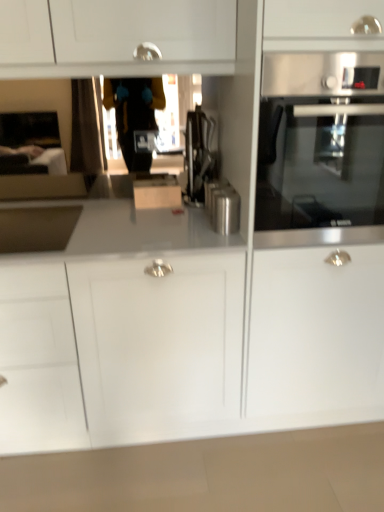
At what (x,y) coordinates should I click in order to perform the action: click on free location above white glossy countertop at lower center (from a real-world perspective). Please return your answer as a coordinate pair (x, y). Looking at the image, I should click on (197, 473).